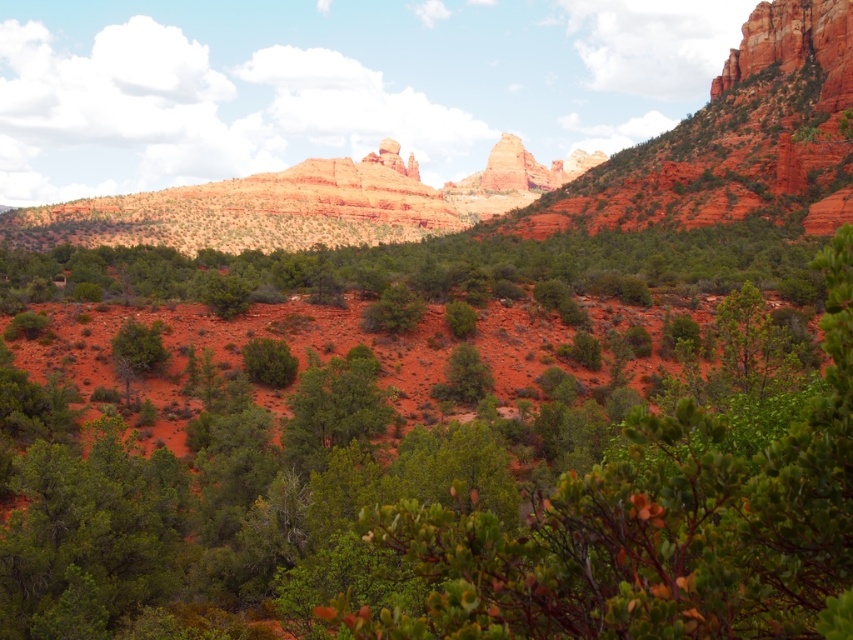
You are standing in the desert landscape and want to reach both the point at coordinates (323, 424) and the point at coordinates (534, 163). Which point will you reach first if you move forward in a straight line?

You will reach the point at coordinates (323, 424) first because it is closer to you than the point at coordinates (534, 163).